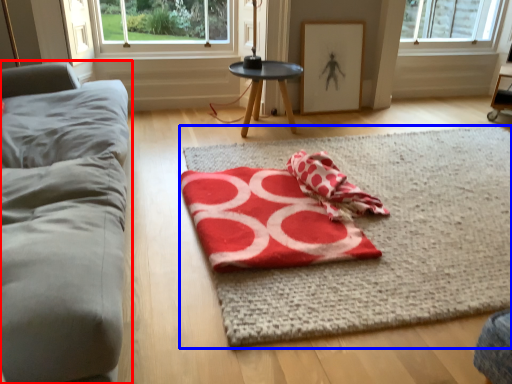
Question: Which object appears closest to the camera in this image, studio couch (highlighted by a red box) or yoga mat (highlighted by a blue box)?

Choices:
 (A) studio couch
 (B) yoga mat

Answer: (A)